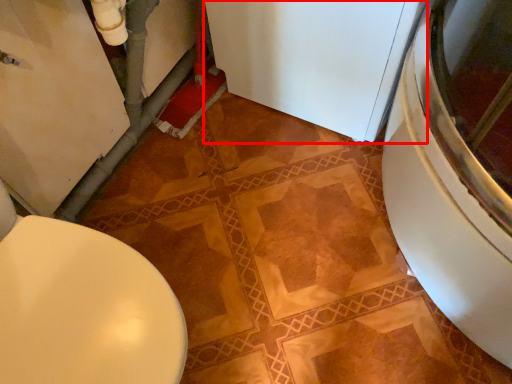
Question: From the image's perspective, what is the correct spatial positioning of appliance (annotated by the red box) in reference to toilet?

Choices:
 (A) below
 (B) above

Answer: (B)